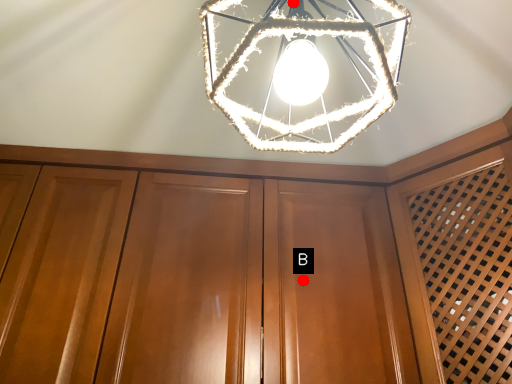
Question: Two points are circled on the image, labeled by A and B beside each circle. Which point appears farthest from the camera in this image?

Choices:
 (A) A is further
 (B) B is further

Answer: (B)